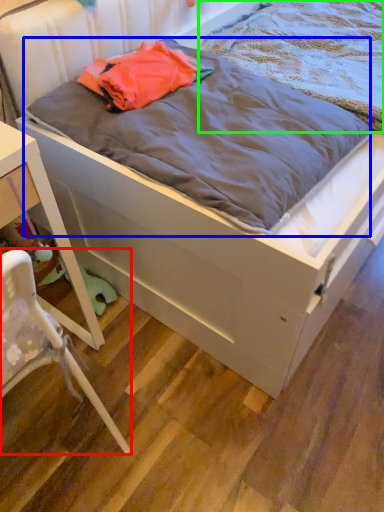
Question: Considering the real-world distances, which object is farthest from chair (highlighted by a red box)? blanket (highlighted by a blue box) or blanket (highlighted by a green box)?

Choices:
 (A) blanket
 (B) blanket

Answer: (B)